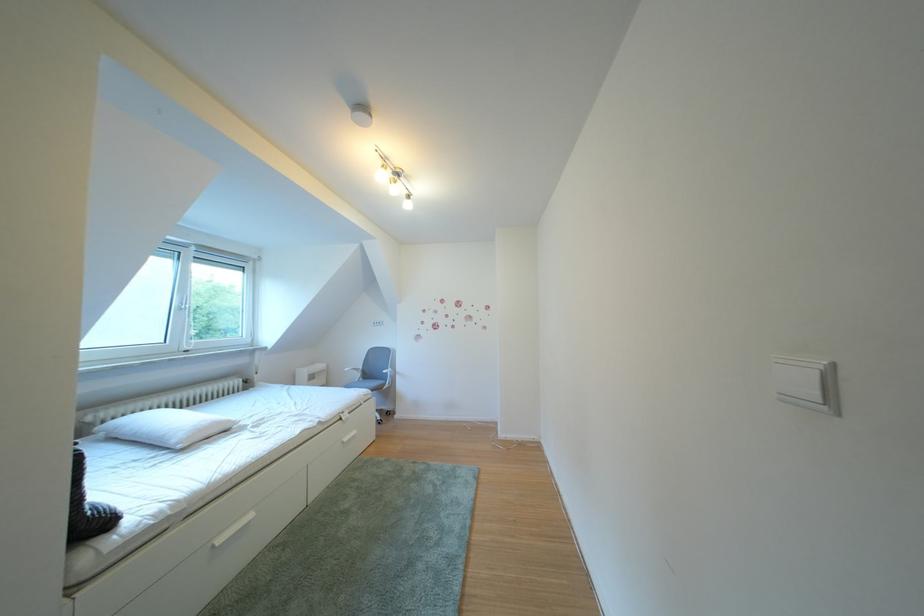
The width and height of the screenshot is (924, 616). What do you see at coordinates (369, 383) in the screenshot?
I see `the chair sitting surface` at bounding box center [369, 383].